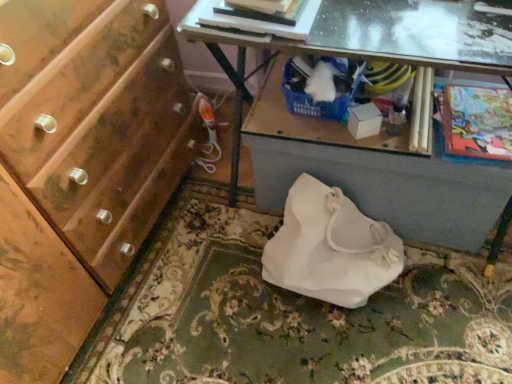
The width and height of the screenshot is (512, 384). In order to click on vacant point to the right of wooden magazine at right, marked as the first magazine in a right-to-left arrangement in this screenshot , I will do `click(466, 103)`.